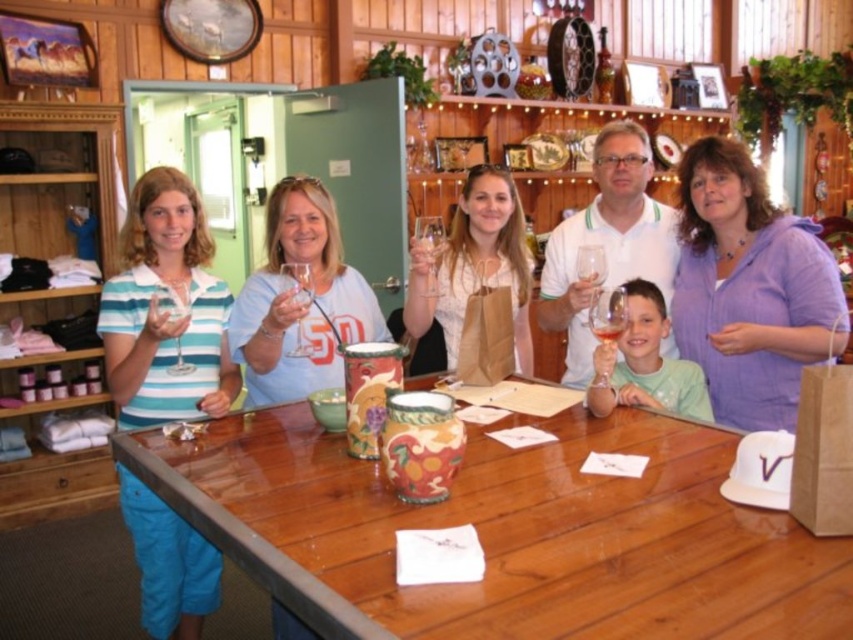
Between wooden table at center and purple cotton shirt at center, which one is positioned higher?

Positioned higher is purple cotton shirt at center.

Does wooden table at center have a smaller size compared to purple cotton shirt at center?

No, wooden table at center is not smaller than purple cotton shirt at center.

Where is `wooden table at center`? wooden table at center is located at coordinates (505, 532).

Find the location of `wooden table at center`. wooden table at center is located at coordinates (505, 532).

Who is more distant from viewer, (618, 204) or (442, 308)?

Positioned behind is point (442, 308).

Which is in front, point (601, 132) or point (442, 300)?

Positioned in front is point (601, 132).

Is point (606, 285) less distant than point (462, 275)?

Yes, it is in front of point (462, 275).

The height and width of the screenshot is (640, 853). Identify the location of white matte shirt at center. (607, 243).

Describe the element at coordinates (750, 289) in the screenshot. This screenshot has height=640, width=853. I see `purple cotton shirt at center` at that location.

This screenshot has height=640, width=853. I want to click on purple cotton shirt at center, so click(750, 289).